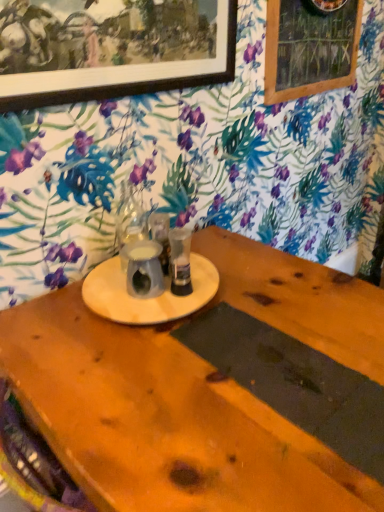
Question: Is wooden picture frame at upper left in front of or behind dark gray matte placemat at bottom center in the image?

Choices:
 (A) behind
 (B) front

Answer: (A)

Question: Visually, is wooden picture frame at upper left positioned to the left or to the right of dark gray matte placemat at bottom center?

Choices:
 (A) left
 (B) right

Answer: (A)

Question: Considering the real-world distances, which object is closest to the translucent glass vase at center, the second tableware from the right?

Choices:
 (A) wooden frame at upper right
 (B) metallic silver cup at center, the 1th tableware from the right
 (C) wooden picture frame at upper left
 (D) dark gray matte placemat at bottom center

Answer: (B)

Question: Estimate the real-world distances between objects in this image. Which object is closer to the metallic silver cup at center, the 1th tableware from the right?

Choices:
 (A) dark gray matte placemat at bottom center
 (B) wooden picture frame at upper left
 (C) translucent glass vase at center, placed as the 1th tableware when sorted from left to right
 (D) wooden frame at upper right

Answer: (C)